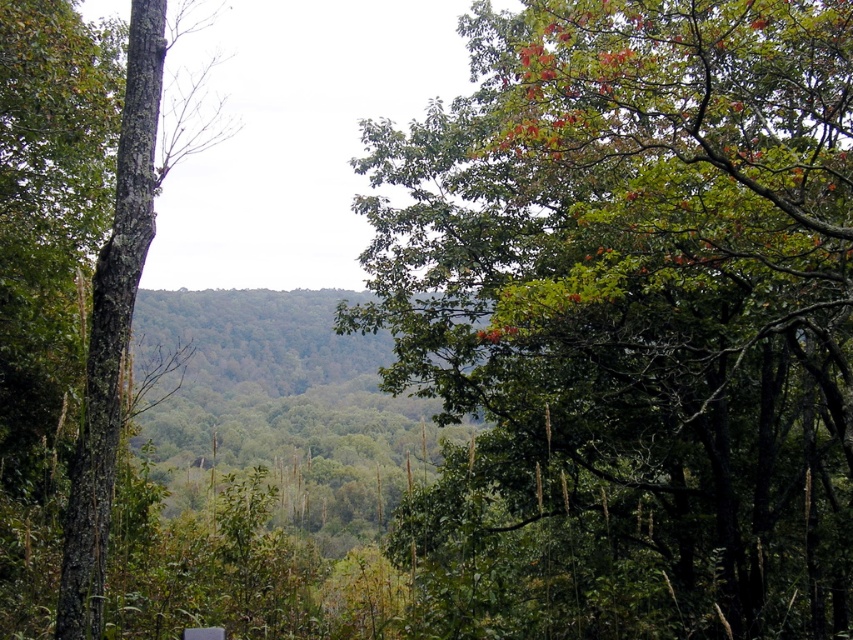
Question: Is green leafy tree at upper center smaller than green rough bark tree at left?

Choices:
 (A) yes
 (B) no

Answer: (A)

Question: Which point is closer to the camera?

Choices:
 (A) green rough bark tree at left
 (B) green leafy tree at upper center

Answer: (A)

Question: Does green leafy tree at upper center come behind green rough bark tree at left?

Choices:
 (A) yes
 (B) no

Answer: (A)

Question: Can you confirm if green leafy tree at upper center is wider than green rough bark tree at left?

Choices:
 (A) yes
 (B) no

Answer: (A)

Question: Which point is closer to the camera taking this photo?

Choices:
 (A) (84, 396)
 (B) (779, 35)

Answer: (A)